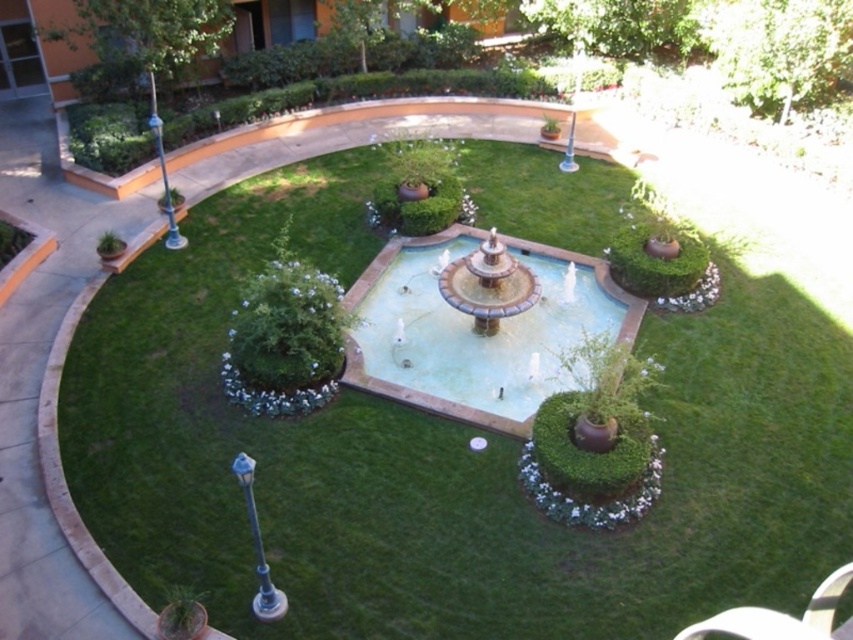
Between green grass at center and smooth stone fountain at center, which one appears on the right side from the viewer's perspective?

Positioned to the right is smooth stone fountain at center.

Is point (363, 461) positioned behind point (393, 314)?

No, (363, 461) is in front of (393, 314).

Find the location of a particular element. The height and width of the screenshot is (640, 853). green grass at center is located at coordinates (444, 456).